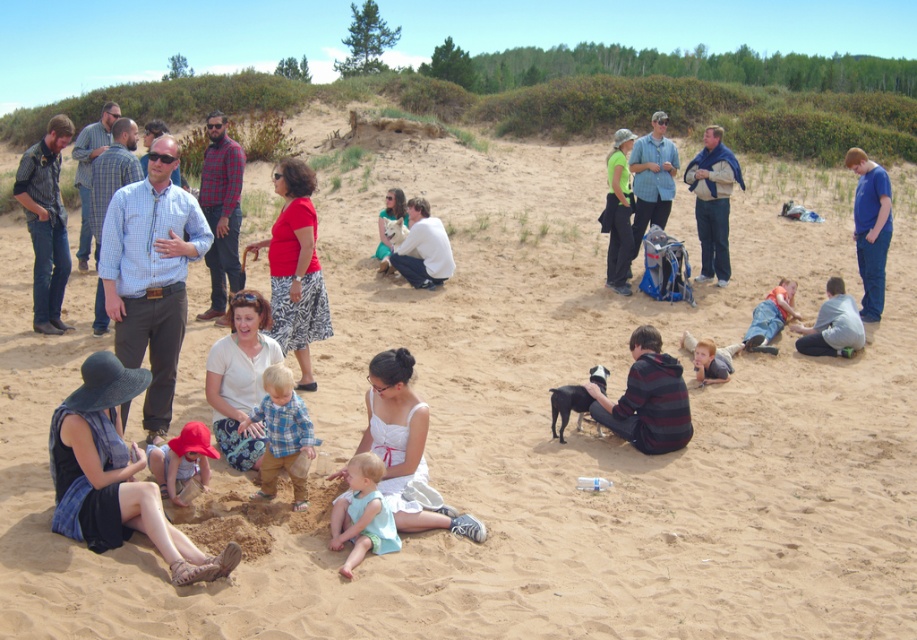
Does denim shirt at left have a greater height compared to blue cotton shirt at right?

Correct, denim shirt at left is much taller as blue cotton shirt at right.

Is point (41, 186) less distant than point (879, 179)?

That is True.

You are a GUI agent. You are given a task and a screenshot of the screen. Output one action in this format:
    pyautogui.click(x=<x>, y=<y>)
    Task: Click on the denim shirt at left
    The image size is (917, 640).
    Given the screenshot: What is the action you would take?
    pyautogui.click(x=46, y=221)

Does plaid flannel shirt at center appear on the left side of light brown fabric shirt at lower right?

Indeed, plaid flannel shirt at center is positioned on the left side of light brown fabric shirt at lower right.

Does plaid flannel shirt at center have a greater width compared to light brown fabric shirt at lower right?

No.

Between point (212, 141) and point (699, 340), which one is positioned in front?

Positioned in front is point (699, 340).

You are a GUI agent. You are given a task and a screenshot of the screen. Output one action in this format:
    pyautogui.click(x=<x>, y=<y>)
    Task: Click on the plaid flannel shirt at center
    
    Given the screenshot: What is the action you would take?
    pyautogui.click(x=221, y=211)

Between point (354, 532) and point (698, 381), which one is positioned in front?

Point (354, 532) is more forward.

Who is higher up, light blue fabric at center or light brown fabric shirt at lower right?

light brown fabric shirt at lower right is above.

Identify the location of light blue fabric at center. This screenshot has width=917, height=640. (362, 513).

This screenshot has height=640, width=917. Find the location of `light blue fabric at center`. light blue fabric at center is located at coordinates (362, 513).